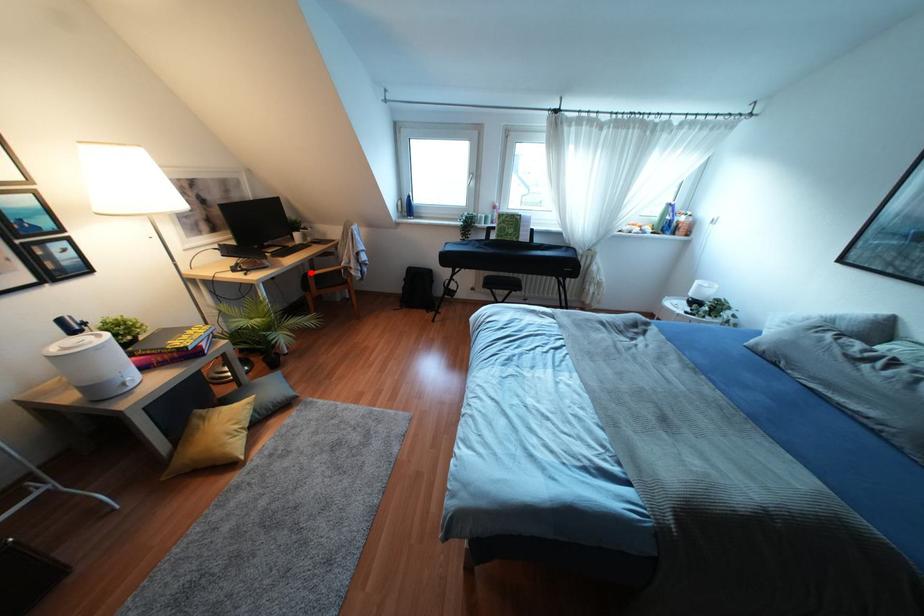
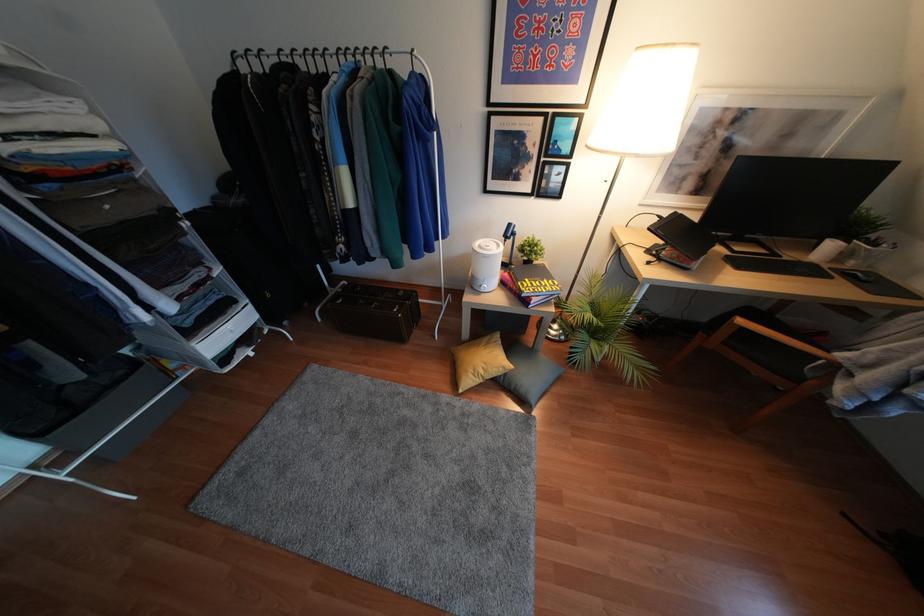
Question: A red point is marked in image1. In image2, is the corresponding 3D point closer to the camera or farther? Reply with the corresponding letter.

Choices:
 (A) The corresponding 3D point is closer.
 (B) The corresponding 3D point is farther.

Answer: (B)